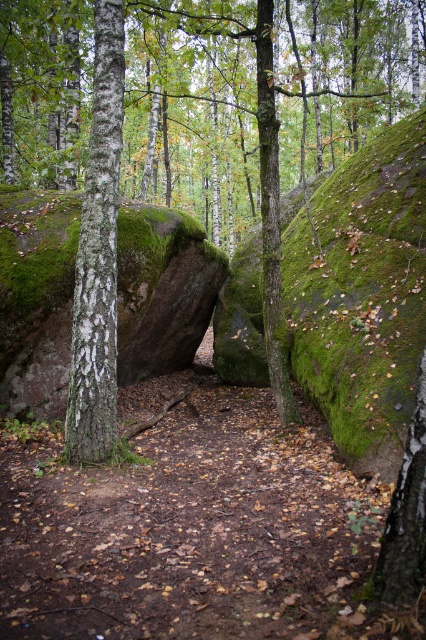
You are a hiker comparing the two tree trunks in the center of the forest scene. Which tree trunk, the white bark tree trunk at center or the green mossy tree trunk at center, has a larger circumference?

The white bark tree trunk at center might be wider than the green mossy tree trunk at center, so it likely has a larger circumference.

You are a hiker who wants to take a photo of the white bark tree trunk at center without the green bark tree at center blocking it. Which direction should you move to get a clear view?

The green bark tree at center is positioned over the white bark tree trunk at center, so you should move to the side, either left or right, to avoid the obstruction caused by the green bark tree at center.

You are standing on the dirt path in the forest and see both the green bark tree at center and the white bark tree trunk at center. Which tree is closer to you?

The green bark tree at center is closer to you than the white bark tree trunk at center.